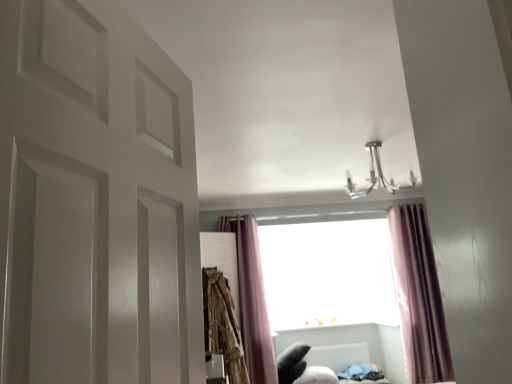
Question: Would you say purple velvet curtain at center, the 2th curtain viewed from the left, is to the left or to the right of transparent glass window at center in the picture?

Choices:
 (A) right
 (B) left

Answer: (A)

Question: In the image, is purple velvet curtain at center, the 1th curtain in the right-to-left sequence, positioned in front of or behind transparent glass window at center?

Choices:
 (A) behind
 (B) front

Answer: (B)

Question: Estimate the real-world distances between objects in this image. Which object is farther from the chrome metallic chandelier at upper center?

Choices:
 (A) transparent glass window at center
 (B) purple velvet curtain at center, the 1th curtain in the right-to-left sequence
 (C) white plastic radiator at lower center
 (D) white matte door at left
 (E) textured beige robe at center-left

Answer: (D)

Question: Estimate the real-world distances between objects in this image. Which object is closer to the chrome metallic chandelier at upper center?

Choices:
 (A) white plastic radiator at lower center
 (B) textured beige robe at center-left
 (C) purple velvet curtain at center, placed as the 1th curtain when sorted from left to right
 (D) purple velvet curtain at center, the 2th curtain viewed from the left
 (E) white matte door at left

Answer: (D)